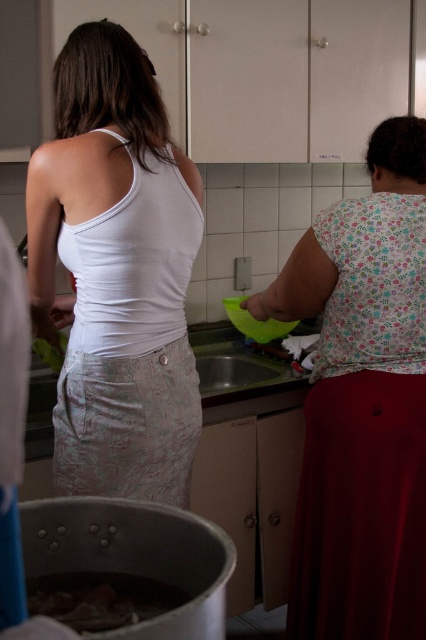
Question: Is dark brown meat at lower left thinner than satin silver sink at center?

Choices:
 (A) no
 (B) yes

Answer: (B)

Question: Is white lace tank top at center thinner than satin silver sink at center?

Choices:
 (A) no
 (B) yes

Answer: (A)

Question: Which point appears farthest from the camera in this image?

Choices:
 (A) (374, 605)
 (B) (127, 161)
 (C) (49, 586)

Answer: (A)

Question: Which point is closer to the camera taking this photo?

Choices:
 (A) (212, 342)
 (B) (403, 582)

Answer: (B)

Question: Among these objects, which one is farthest from the camera?

Choices:
 (A) dark brown meat at lower left
 (B) floral fabric blouse at upper right
 (C) white lace tank top at center

Answer: (B)

Question: Does white lace tank top at center appear on the right side of dark brown meat at lower left?

Choices:
 (A) no
 (B) yes

Answer: (A)